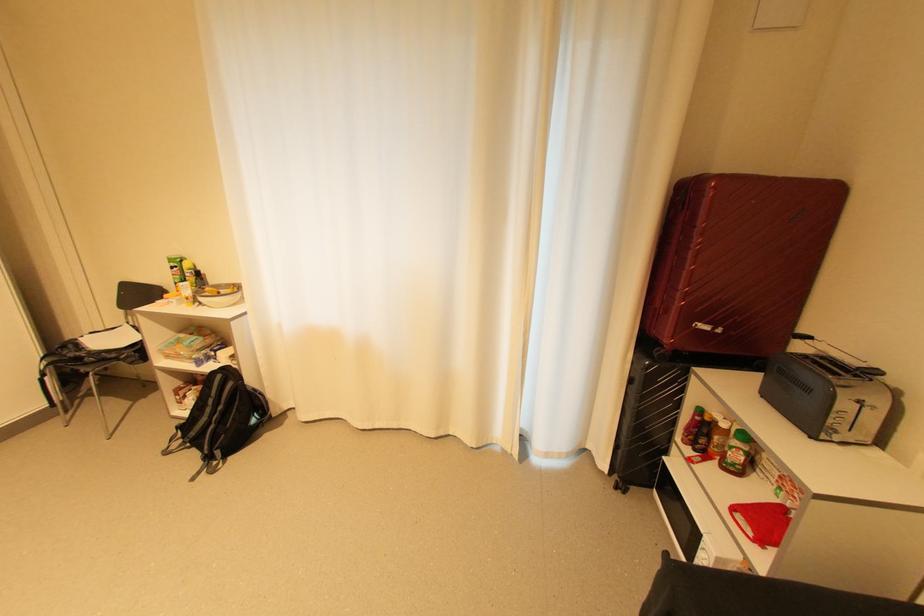
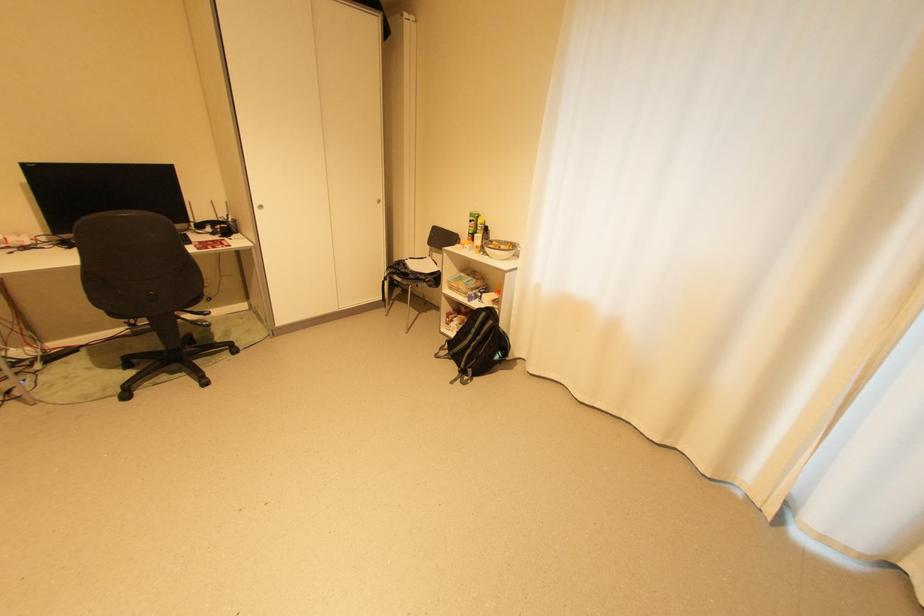
Find the pixel in the second image that matches point (226, 377) in the first image.

(492, 314)